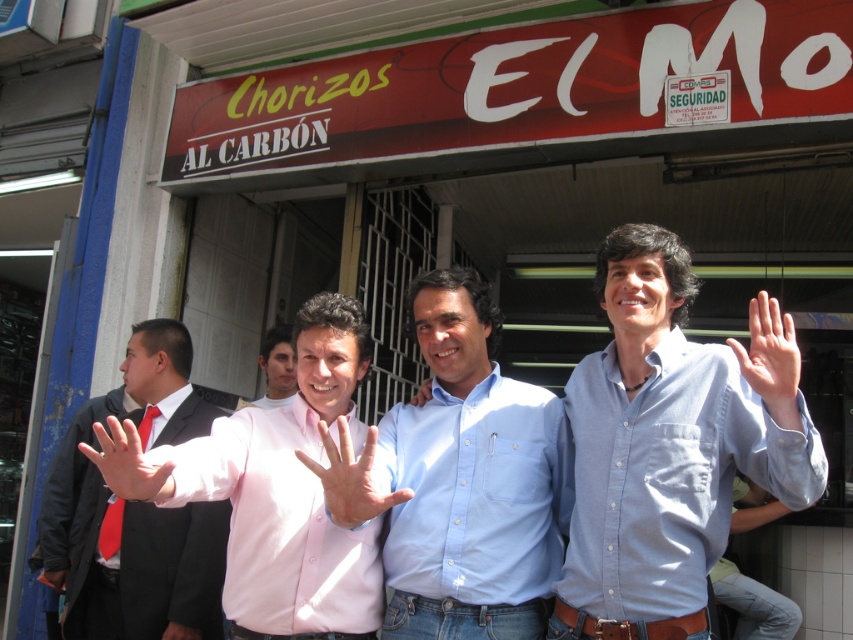
You are a photographer adjusting the lighting for a group photo. You notice two pink items in the frame at the center of the image. One is a pink matte shirt and the other is a person with pink smooth skin. The distance between them is crucial for proper lighting. How far apart are the pink matte shirt at center and the pink smooth skin at center?

The pink matte shirt at center and the pink smooth skin at center are 32.35 centimeters apart from each other.

You are a photographer trying to capture a group photo of the men outside the storefront. You notice two pink items in the scene. Which one is wider between the pink smooth skin at center and the pink fabric hand at center?

The pink smooth skin at center is wider than the pink fabric hand at center.

You are a photographer trying to capture the pink smooth skin at center in the image. The camera is focused at point (350,477). Is the pink smooth skin at center in focus?

Yes, the pink smooth skin at center is in focus because it is located exactly at point (350,477) where the camera is focused.